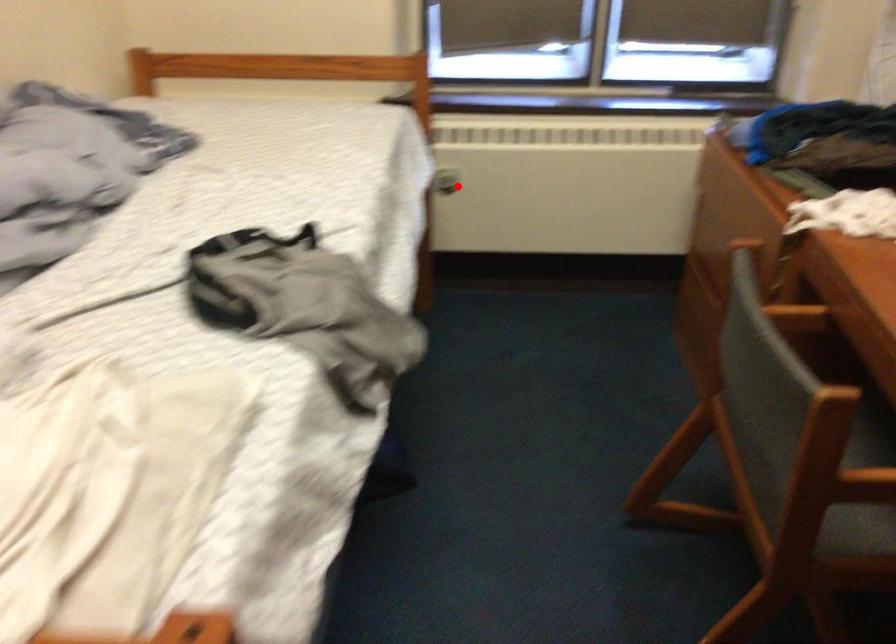
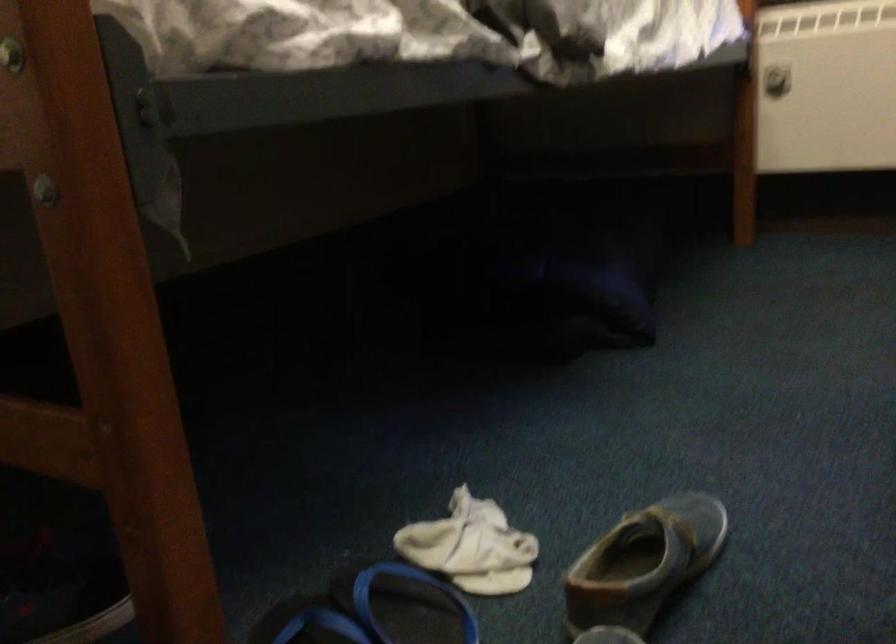
Where in the second image is the point corresponding to the highlighted location from the first image?

(776, 80)